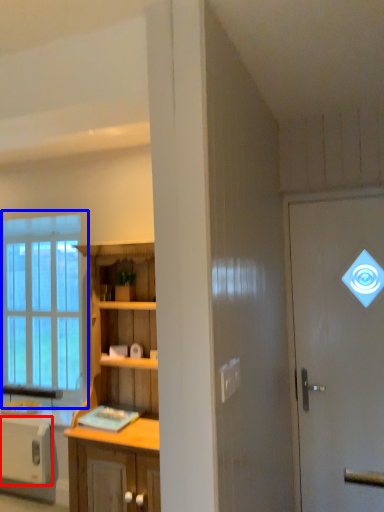
Question: Among these objects, which one is farthest to the camera, appliance (highlighted by a red box) or window (highlighted by a blue box)?

Choices:
 (A) appliance
 (B) window

Answer: (B)